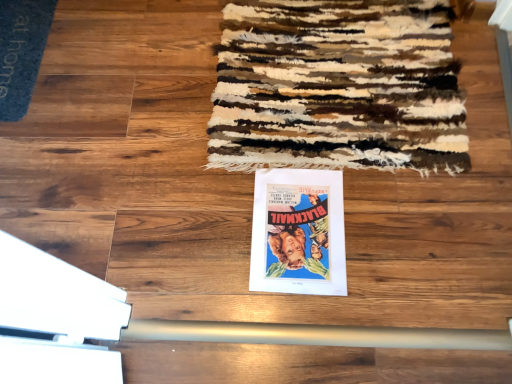
Where is `vacant space behind matte paper poster at center`? This screenshot has width=512, height=384. vacant space behind matte paper poster at center is located at coordinates (287, 134).